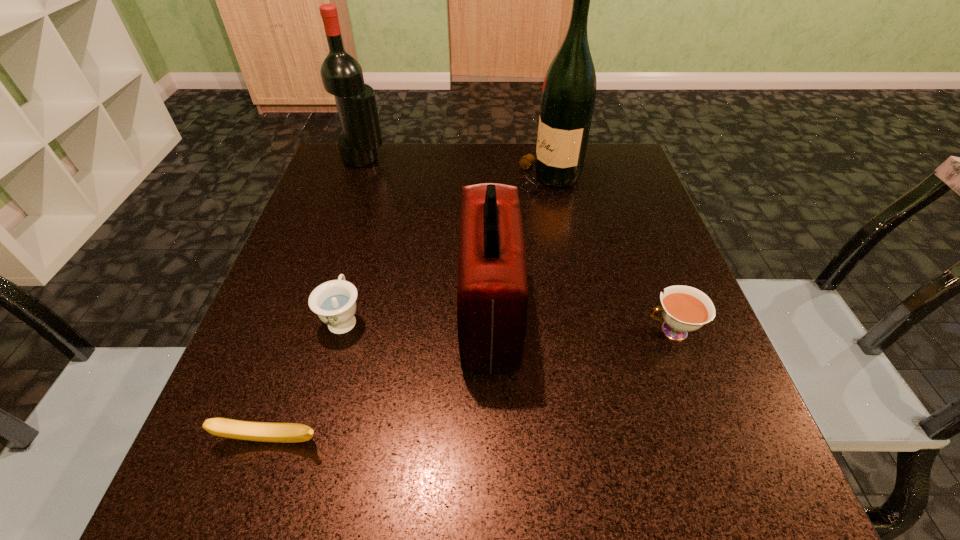
This screenshot has height=540, width=960. Identify the location of free space between the left wine bottle and the fourth shortest object. (426, 237).

Identify the location of empty space between the second object from right to left and the shortest object. The width and height of the screenshot is (960, 540). (409, 309).

Locate an element on the screen. free space between the first aid kit and the nearest object is located at coordinates (380, 377).

You are a GUI agent. You are given a task and a screenshot of the screen. Output one action in this format:
    pyautogui.click(x=<x>, y=<y>)
    Task: Click on the vacant space that is in between the left teacup and the nearest object
    
    Given the screenshot: What is the action you would take?
    pyautogui.click(x=307, y=379)

Identify the location of vacant area between the left teacup and the third tallest object. (417, 316).

I want to click on empty location between the shortest object and the third tallest object, so click(x=380, y=377).

Where is `vacant area that lies between the banana and the left teacup`? vacant area that lies between the banana and the left teacup is located at coordinates (307, 379).

Select which object appears as the fourth closest to the left wine bottle. Please provide its 2D coordinates. Your answer should be formatted as a tuple, i.e. [(x, y)], where the tuple contains the x and y coordinates of a point satisfying the conditions above.

[(236, 429)]

Locate which object is the third closest to the right teacup. Please provide its 2D coordinates. Your answer should be formatted as a tuple, i.e. [(x, y)], where the tuple contains the x and y coordinates of a point satisfying the conditions above.

[(334, 302)]